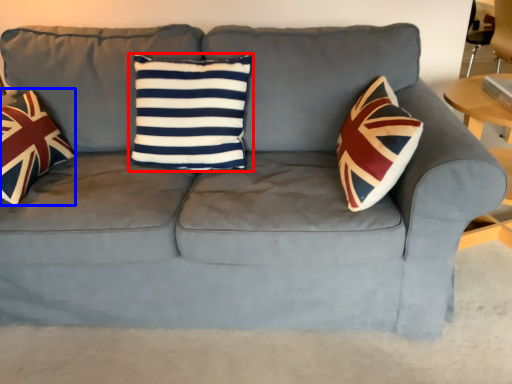
Question: Which object is closer to the camera taking this photo, pillow (highlighted by a red box) or throw pillow (highlighted by a blue box)?

Choices:
 (A) pillow
 (B) throw pillow

Answer: (B)